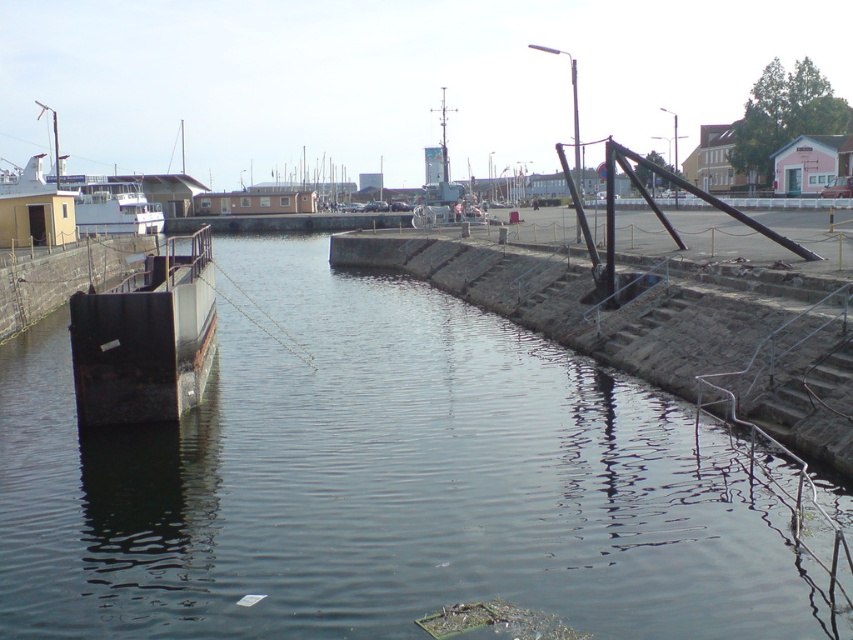
Which is more to the right, dark gray water at center or white matte boat at left?

Positioned to the right is dark gray water at center.

Is dark gray water at center bigger than white matte boat at left?

No, dark gray water at center is not bigger than white matte boat at left.

Looking at this image, measure the distance between dark gray water at center and camera.

dark gray water at center and camera are 7.51 meters apart.

Image resolution: width=853 pixels, height=640 pixels. Find the location of `dark gray water at center`. dark gray water at center is located at coordinates (376, 481).

Does dark gray water at center have a larger size compared to rusty metal barge at left?

Yes, dark gray water at center is bigger than rusty metal barge at left.

Does dark gray water at center have a lesser width compared to rusty metal barge at left?

In fact, dark gray water at center might be wider than rusty metal barge at left.

Which is in front, point (372, 477) or point (143, 374)?

Positioned in front is point (372, 477).

At what (x,y) coordinates should I click in order to perform the action: click on dark gray water at center. Please return your answer as a coordinate pair (x, y). Looking at the image, I should click on (376, 481).

How distant is rusty metal barge at left from white matte boat at left?

rusty metal barge at left is 51.55 meters from white matte boat at left.

Is point (140, 298) farther from viewer compared to point (115, 216)?

That is False.

Is point (108, 316) farther from camera compared to point (122, 224)?

No.

Find the location of a particular element. This screenshot has height=640, width=853. rusty metal barge at left is located at coordinates (144, 339).